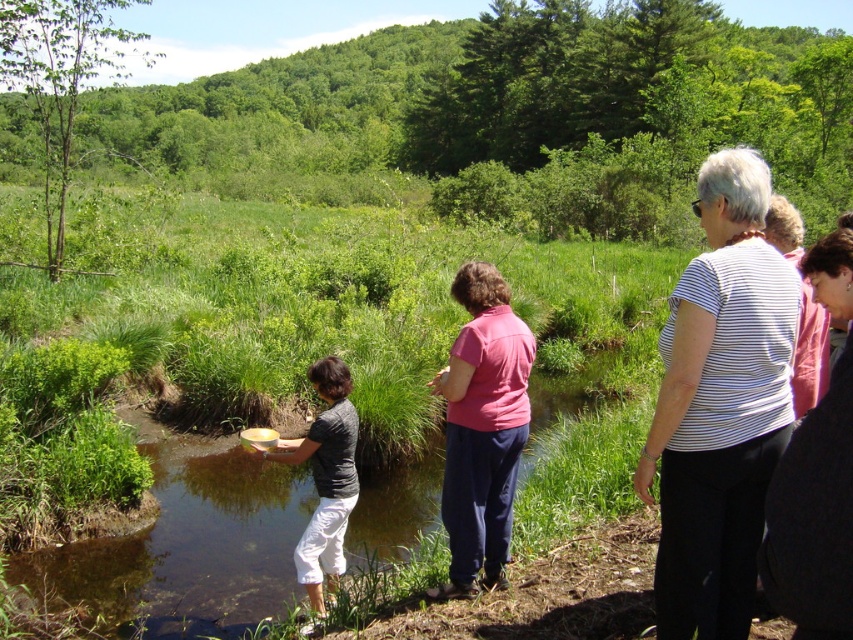
Question: Does white striped shirt at right appear under pink cotton shirt at center?

Choices:
 (A) yes
 (B) no

Answer: (A)

Question: Which object is farther from the camera taking this photo?

Choices:
 (A) pink cotton shirt at center
 (B) white striped shirt at right

Answer: (A)

Question: Does white striped shirt at right come in front of pink cotton shirt at center?

Choices:
 (A) yes
 (B) no

Answer: (A)

Question: Which point is closer to the camera?

Choices:
 (A) (489, 461)
 (B) (692, 467)

Answer: (B)

Question: In this image, where is white striped shirt at right located relative to pink cotton shirt at center?

Choices:
 (A) below
 (B) above

Answer: (A)